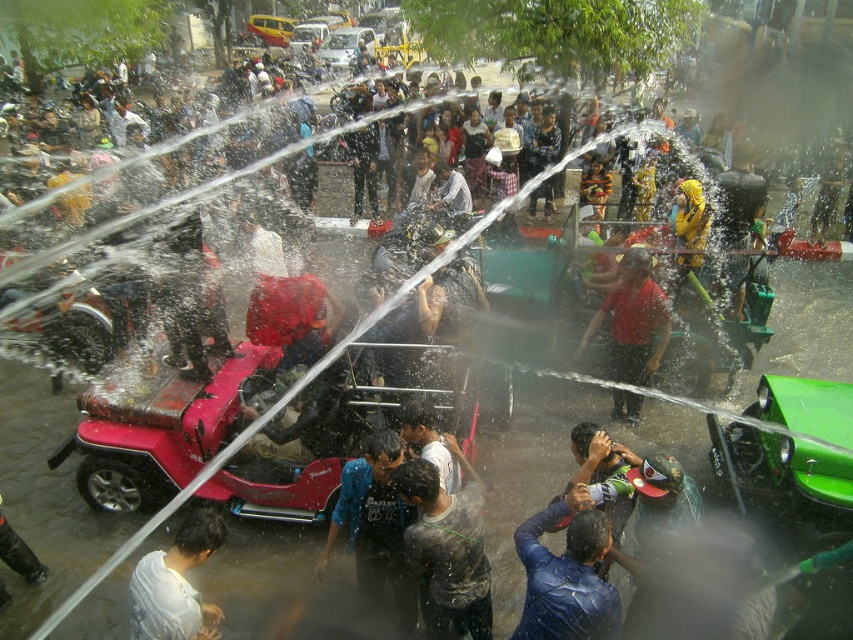
Question: Can you confirm if wet skin at center is wider than matte red shirt at center?

Choices:
 (A) no
 (B) yes

Answer: (A)

Question: Which of the following is the farthest from the observer?

Choices:
 (A) coord(393,550)
 (B) coord(529,536)
 (C) coord(7,600)
 (D) coord(199,637)

Answer: (C)

Question: Based on their relative distances, which object is farther from the white matte shirt at lower left?

Choices:
 (A) wet skin at center
 (B) blue fabric shirt at center
 (C) dark gray rubber boot at lower left
 (D) matte red shirt at center

Answer: (D)

Question: Does white matte shirt at lower left have a greater width compared to dark gray rubber boot at lower left?

Choices:
 (A) yes
 (B) no

Answer: (A)

Question: Which object is the farthest from the dark blue leather jacket at lower center?

Choices:
 (A) blue fabric shirt at center
 (B) white matte shirt at lower left
 (C) wet skin at center
 (D) dark gray rubber boot at lower left

Answer: (D)

Question: In this image, where is wet skin at center located relative to dark blue leather jacket at lower center?

Choices:
 (A) left
 (B) right

Answer: (A)